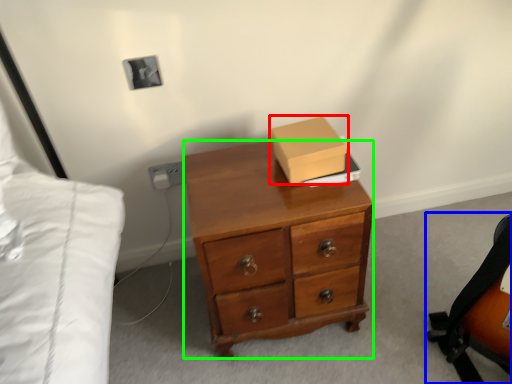
Question: Which object is positioned farthest from box (highlighted by a red box)? Select from messenger bag (highlighted by a blue box) and desk (highlighted by a green box).

Choices:
 (A) messenger bag
 (B) desk

Answer: (A)